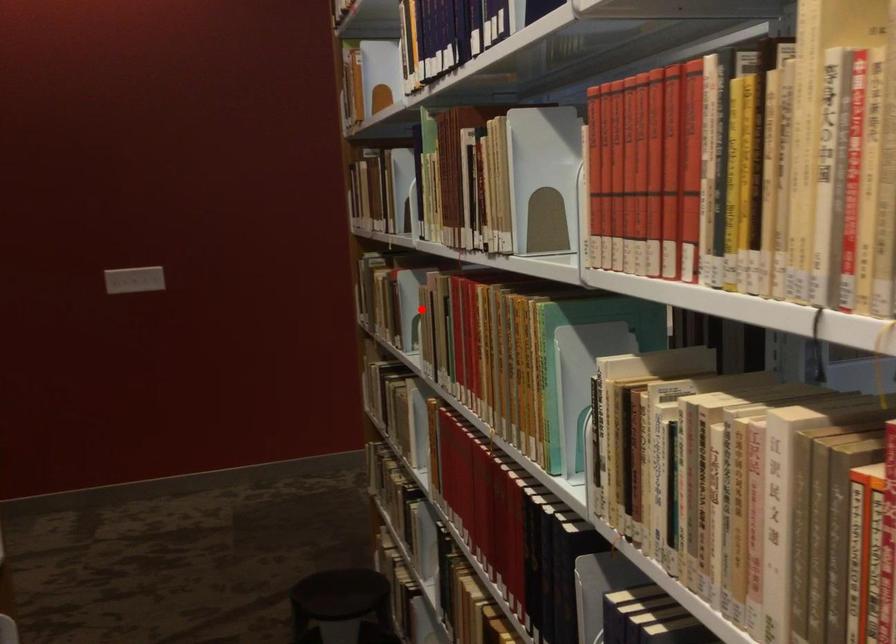
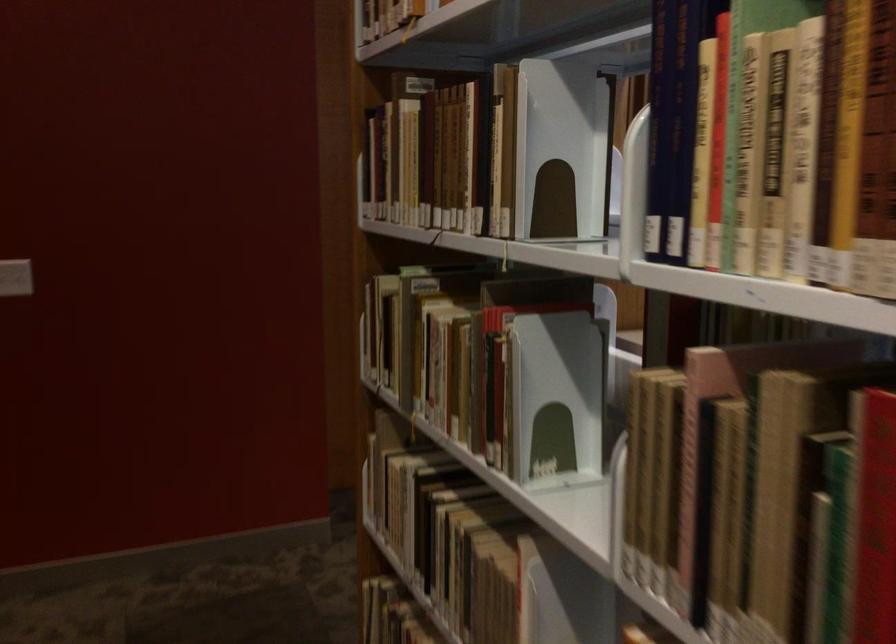
Where in the second image is the point corresponding to the highlighted location from the first image?

(556, 398)